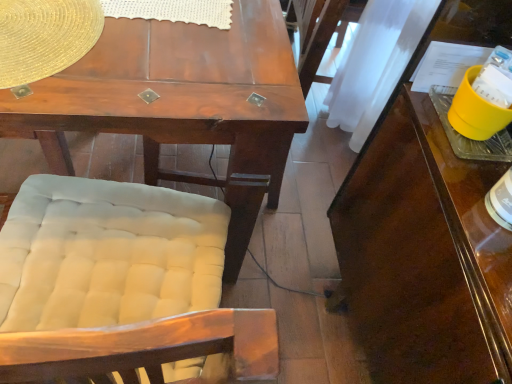
Question: Should I look upward or downward to see wooden desk at center?

Choices:
 (A) down
 (B) up

Answer: (A)